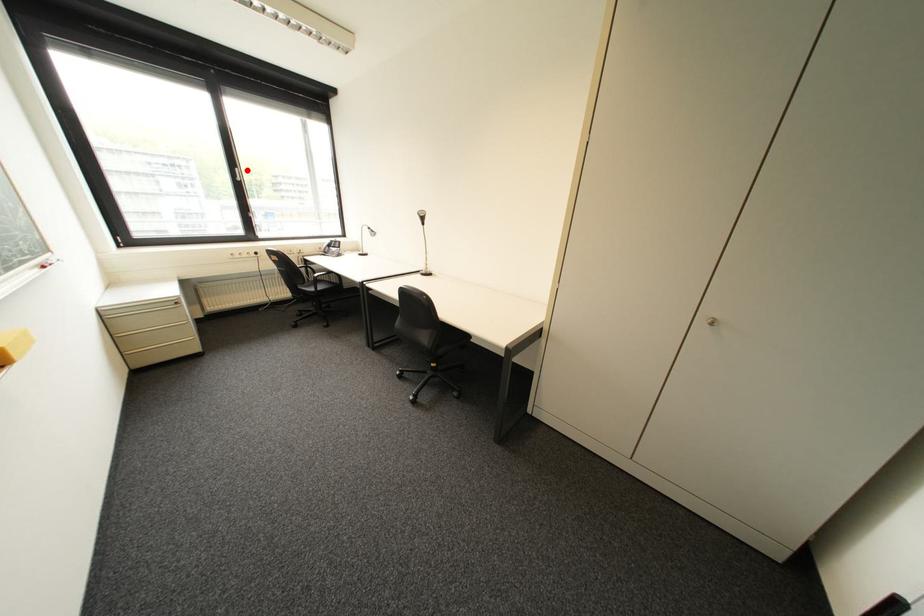
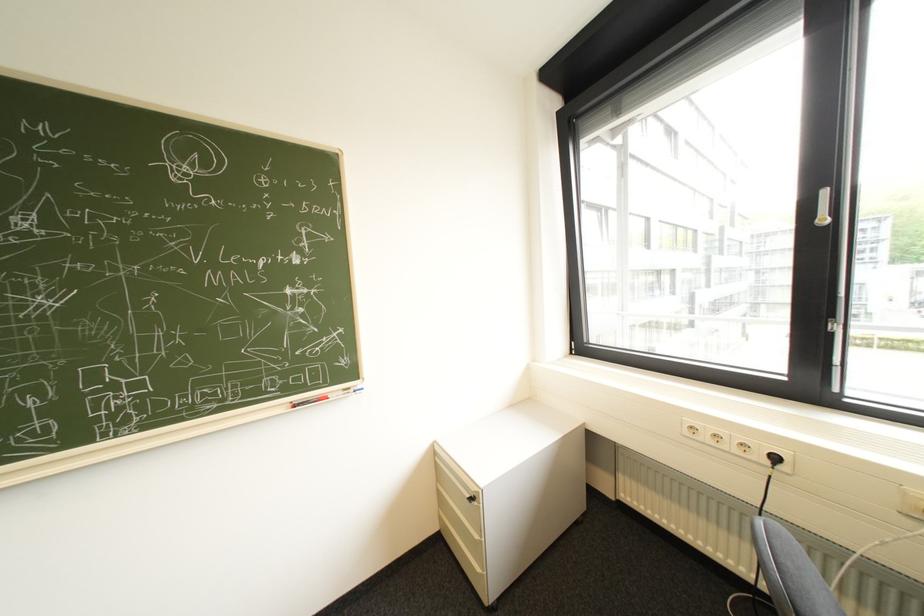
Where in the second image is the point corresponding to the highlighted location from the first image?

(834, 193)